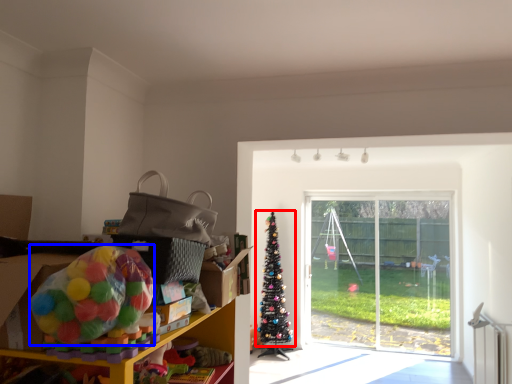
Question: Which object is further to the camera taking this photo, christmas tree (highlighted by a red box) or toy (highlighted by a blue box)?

Choices:
 (A) christmas tree
 (B) toy

Answer: (A)